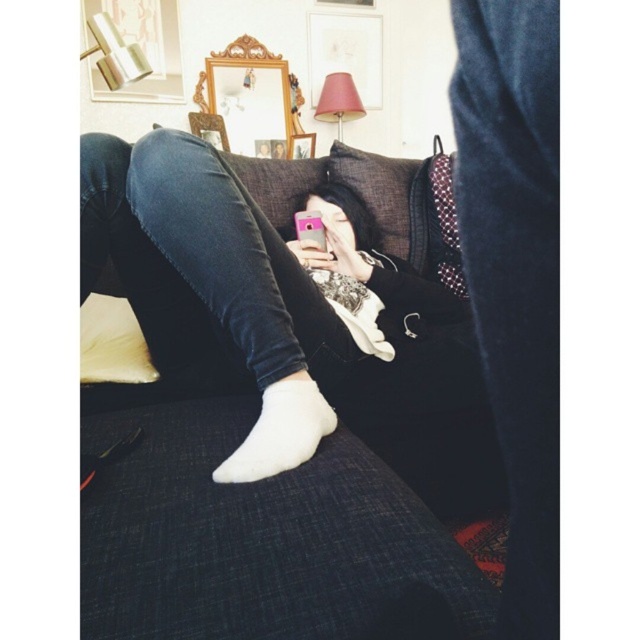
What do you see at coordinates (280, 432) in the screenshot? I see `white cotton sock at lower center` at bounding box center [280, 432].

I want to click on white cotton sock at lower center, so click(280, 432).

Between point (412, 412) and point (141, 360), which one is positioned in front?

Point (141, 360)

Who is higher up, dark fabric couch at center or white fabric pillow at left?

Positioned higher is white fabric pillow at left.

Where is `dark fabric couch at center`? dark fabric couch at center is located at coordinates (282, 316).

Which is in front, point (545, 324) or point (108, 300)?

Positioned in front is point (545, 324).

Can you confirm if velvet dark blue pants at lower right is positioned to the left of white fabric pillow at left?

In fact, velvet dark blue pants at lower right is to the right of white fabric pillow at left.

Between point (531, 221) and point (134, 355), which one is positioned behind?

Positioned behind is point (134, 355).

Where is `velvet dark blue pants at lower right`? The image size is (640, 640). velvet dark blue pants at lower right is located at coordinates (515, 273).